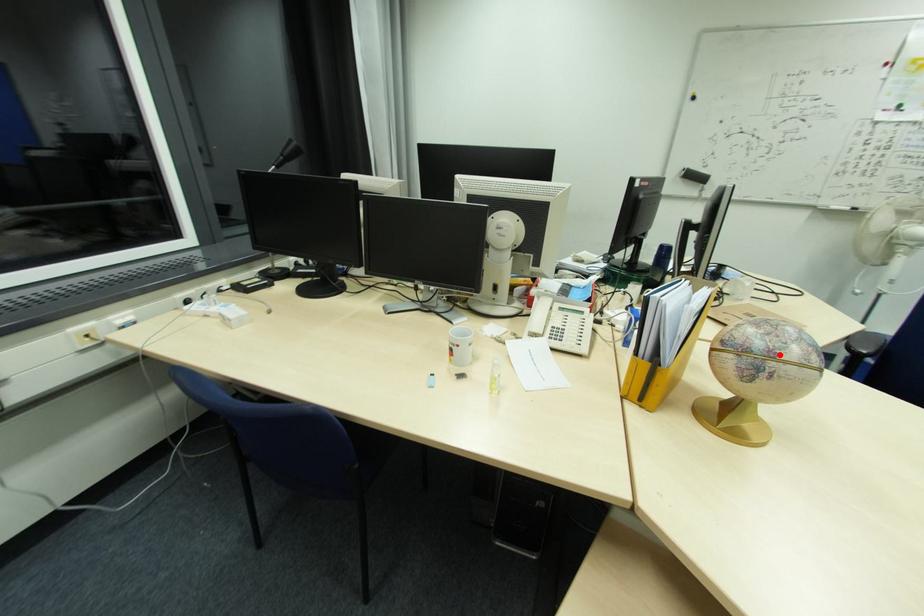
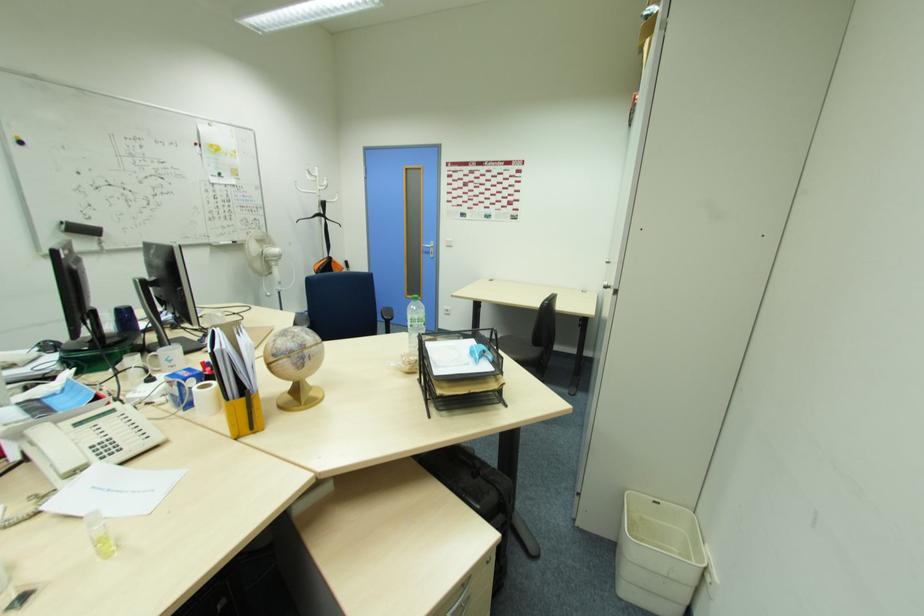
Where in the second image is the point corresponding to the highlighted location from the first image?

(309, 346)